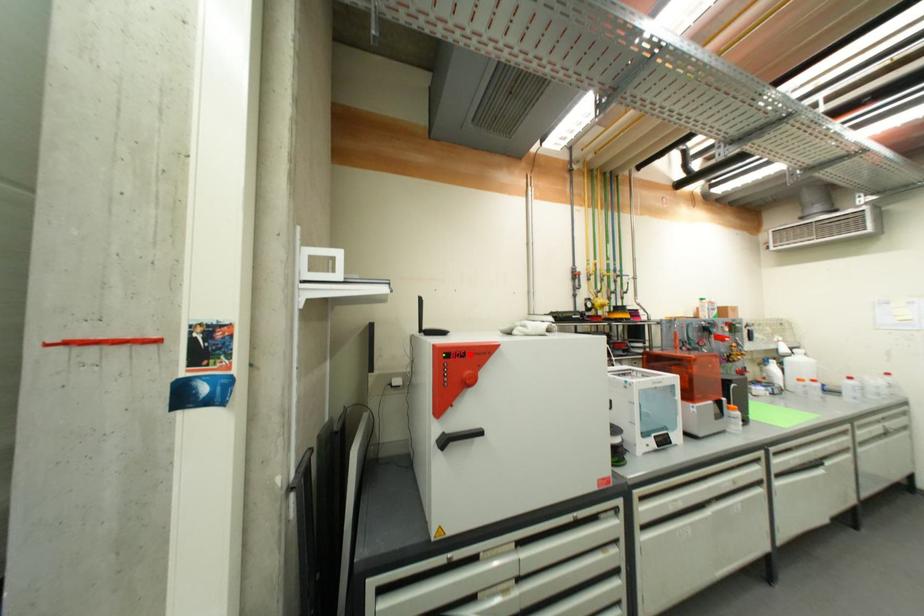
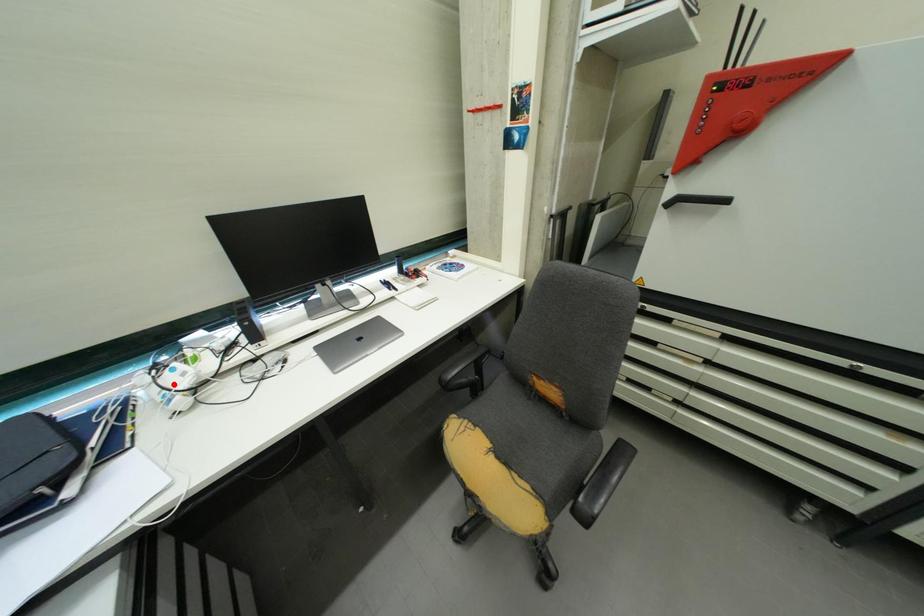
I am providing you with two images of the same scene from different viewpoints. A red point is marked on the first image and another point is marked on the second image. Are the points marked in image1 and image2 representing the same 3D position?

No